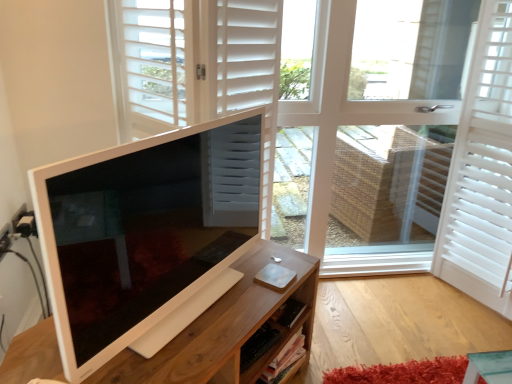
Question: From a real-world perspective, is white matte door at center above or below wooden desk at center?

Choices:
 (A) above
 (B) below

Answer: (A)

Question: In terms of width, does white matte door at center look wider or thinner when compared to wooden desk at center?

Choices:
 (A) wide
 (B) thin

Answer: (A)

Question: Which is farther from the white matte window at center?

Choices:
 (A) white glossy computer monitor at left
 (B) wooden desk at center
 (C) white matte door at center
 (D) white matte shutter at right

Answer: (B)

Question: Which object is the closest to the white matte shutter at right?

Choices:
 (A) white matte door at center
 (B) white glossy computer monitor at left
 (C) white matte window at center
 (D) wooden desk at center

Answer: (C)